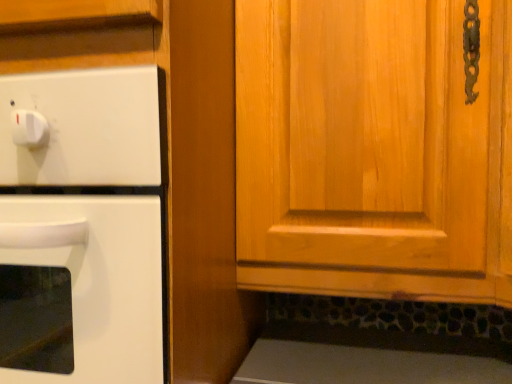
Question: Is white glossy oven at left to the right of wooden cabinet at center from the viewer's perspective?

Choices:
 (A) no
 (B) yes

Answer: (A)

Question: Is the depth of white glossy oven at left less than that of wooden cabinet at center?

Choices:
 (A) no
 (B) yes

Answer: (A)

Question: Is white glossy oven at left touching wooden cabinet at center?

Choices:
 (A) no
 (B) yes

Answer: (A)

Question: From a real-world perspective, is white glossy oven at left on wooden cabinet at center?

Choices:
 (A) no
 (B) yes

Answer: (A)

Question: Considering the relative sizes of white glossy oven at left and wooden cabinet at center in the image provided, is white glossy oven at left wider than wooden cabinet at center?

Choices:
 (A) no
 (B) yes

Answer: (A)

Question: Is white glossy oven at left taller than wooden cabinet at center?

Choices:
 (A) yes
 (B) no

Answer: (A)

Question: Is wooden cabinet at center smaller than white glossy oven at left?

Choices:
 (A) yes
 (B) no

Answer: (B)

Question: From a real-world perspective, is wooden cabinet at center under white glossy oven at left?

Choices:
 (A) yes
 (B) no

Answer: (B)

Question: Considering the relative positions of wooden cabinet at center and white glossy oven at left in the image provided, is wooden cabinet at center in front of white glossy oven at left?

Choices:
 (A) yes
 (B) no

Answer: (A)

Question: Considering the relative sizes of wooden cabinet at center and white glossy oven at left in the image provided, is wooden cabinet at center bigger than white glossy oven at left?

Choices:
 (A) yes
 (B) no

Answer: (A)

Question: Considering the relative sizes of wooden cabinet at center and white glossy oven at left in the image provided, is wooden cabinet at center wider than white glossy oven at left?

Choices:
 (A) yes
 (B) no

Answer: (A)

Question: From a real-world perspective, is wooden cabinet at center physically above white glossy oven at left?

Choices:
 (A) no
 (B) yes

Answer: (B)

Question: Is white glossy oven at left inside the boundaries of wooden cabinet at center, or outside?

Choices:
 (A) outside
 (B) inside

Answer: (A)